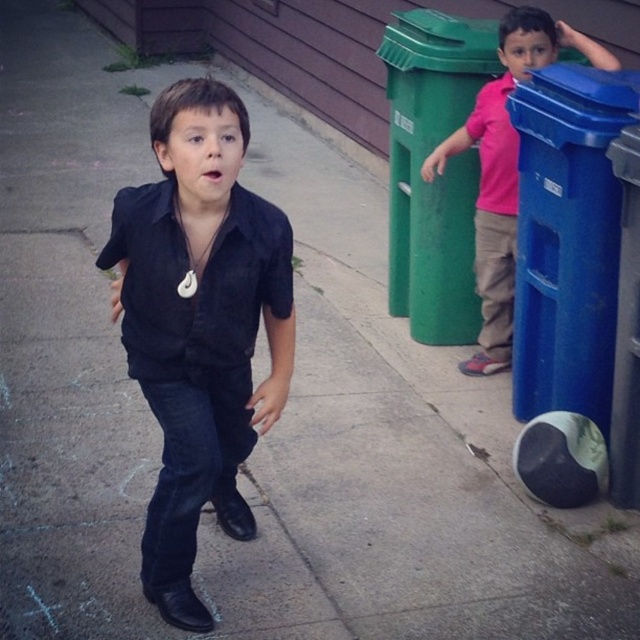
You are a delivery person who needs to place a large package on the sidewalk. There are a blue plastic recycling bin at right and a pink fabric shirt at right in the way. Which object should you move to make space?

The blue plastic recycling bin at right is smaller than the pink fabric shirt at right, so you should move the blue plastic recycling bin at right first because it is easier to move due to its smaller size.

You are a delivery person who needs to place a package on the curb. The package is 4 meters long. Can you place the entire package on the ground between the brushed metal curb at center and the pink fabric shirt at right without overlapping either object?

The distance between the brushed metal curb at center and the pink fabric shirt at right is 3.90 meters. Since the package is 4 meters long, it would be 0.10 meters too long to fit entirely between them without overlapping either object.

You are a delivery person trying to place a large package on the sidewalk between the blue plastic recycling bin at right and the green plastic curb at upper center. Can you fit the package there if it requires 1 meter of space?

The blue plastic recycling bin at right is in front of the green plastic curb at upper center, but the distance between them isn t specified in the objects description. Without knowing the exact spacing, it s impossible to determine if the 1 meter requirement is met.